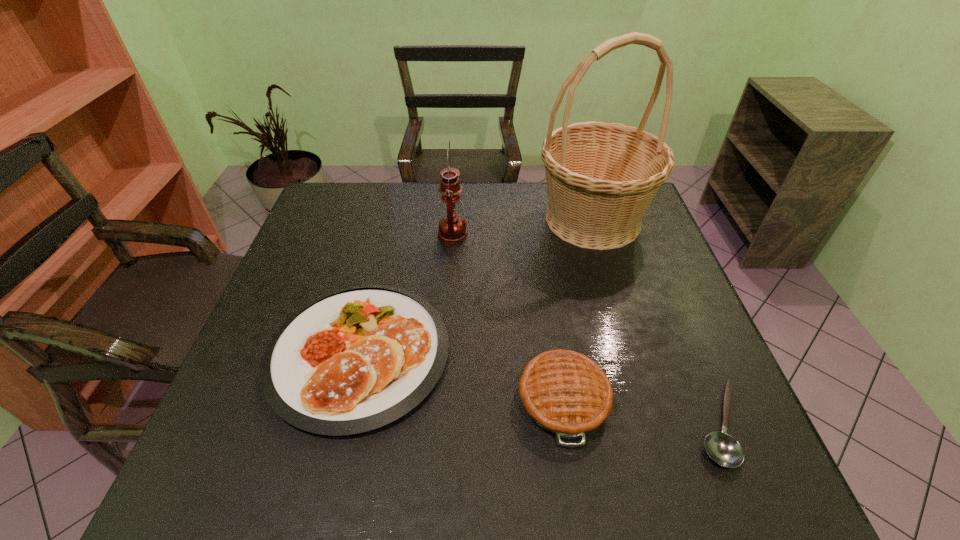
Locate an element on the screen. basket at the far edge is located at coordinates (601, 177).

I want to click on oil lamp present at the far edge, so tap(452, 228).

Image resolution: width=960 pixels, height=540 pixels. Find the location of `pie located in the near edge section of the desktop`. pie located in the near edge section of the desktop is located at coordinates (564, 392).

The image size is (960, 540). I want to click on ladle at the near edge, so click(722, 448).

Locate an element on the screen. The width and height of the screenshot is (960, 540). object situated at the left edge is located at coordinates (356, 359).

Locate an element on the screen. basket situated at the right edge is located at coordinates (601, 177).

Identify the location of ladle at the right edge. This screenshot has width=960, height=540. (722, 448).

You are a GUI agent. You are given a task and a screenshot of the screen. Output one action in this format:
    pyautogui.click(x=<x>, y=<y>)
    Task: Click on the object that is at the far right corner
    
    Given the screenshot: What is the action you would take?
    pyautogui.click(x=601, y=177)

Locate an element on the screen. The height and width of the screenshot is (540, 960). object located at the near right corner is located at coordinates (722, 448).

You are a GUI agent. You are given a task and a screenshot of the screen. Output one action in this format:
    pyautogui.click(x=<x>, y=<y>)
    Task: Click on the vacant region at the far edge of the desktop
    This screenshot has width=960, height=540.
    Given the screenshot: What is the action you would take?
    pyautogui.click(x=537, y=201)